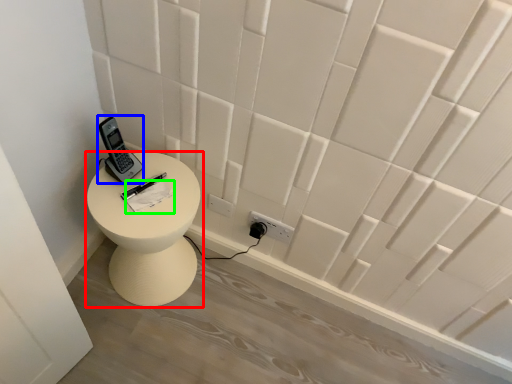
Question: Considering the real-world distances, which object is closest to furniture (highlighted by a red box)? control (highlighted by a blue box) or notepad (highlighted by a green box).

Choices:
 (A) control
 (B) notepad

Answer: (B)